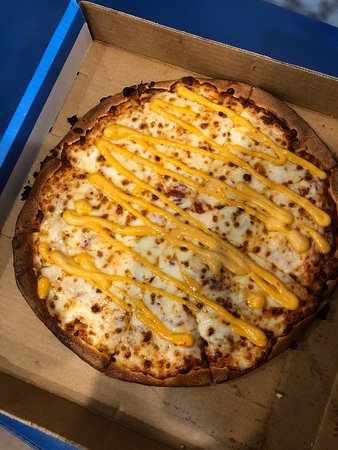
You are a GUI agent. You are given a task and a screenshot of the screen. Output one action in this format:
    pyautogui.click(x=<x>, y=<y>)
    Task: Click on the table background
    
    Given the screenshot: What is the action you would take?
    pyautogui.click(x=322, y=3)